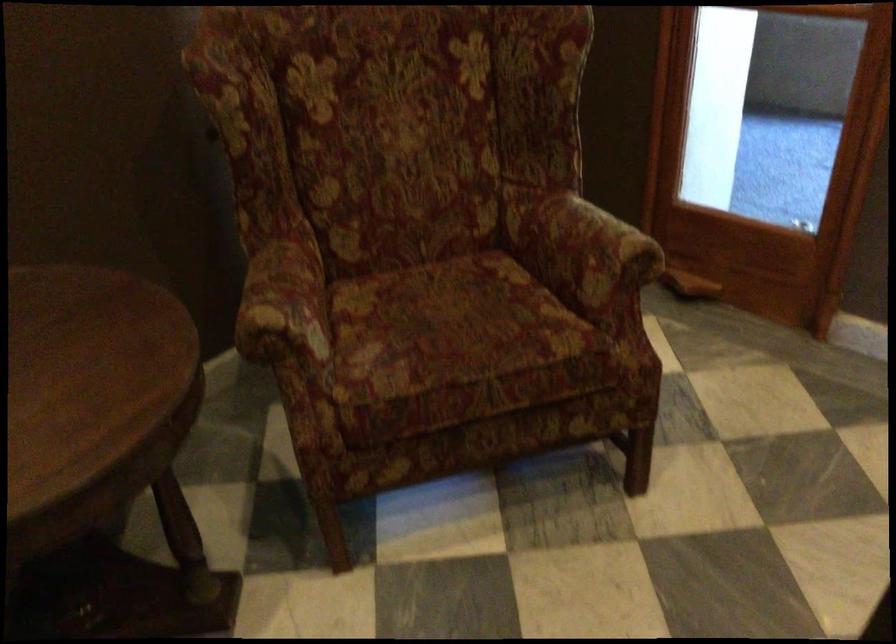
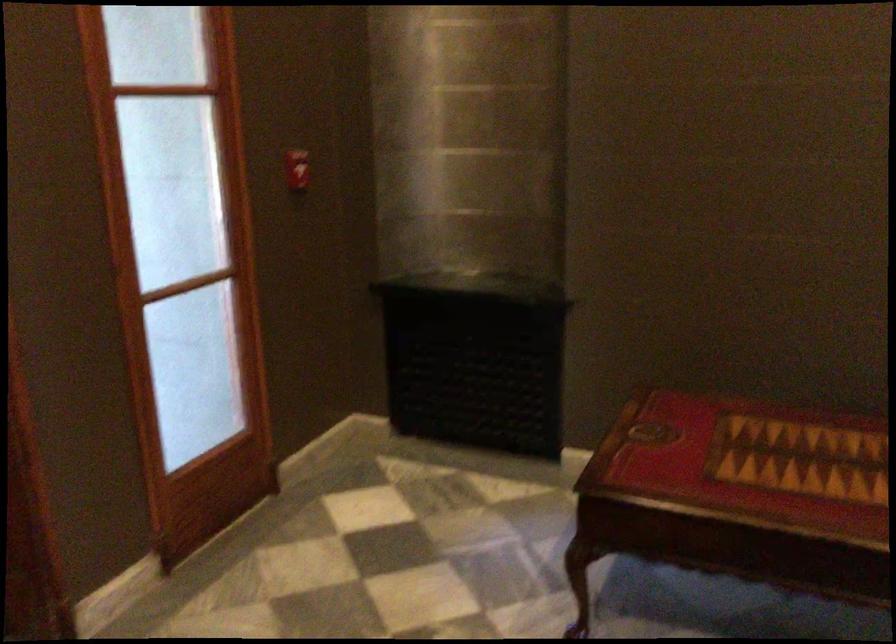
Based on the continuous images, in which direction is the camera rotating?

The rotation direction of the camera is right-down.